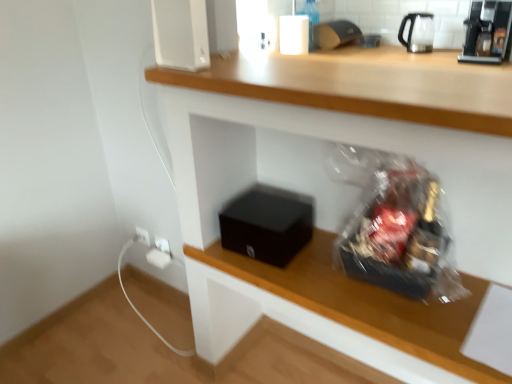
Locate an element on the screen. vacant region above black matte box at center (from a real-world perspective) is located at coordinates (268, 208).